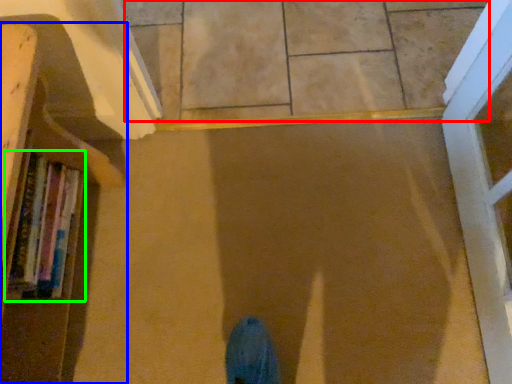
Question: Estimate the real-world distances between objects in this image. Which object is closer to tile (highlighted by a red box), bookcase (highlighted by a blue box) or book (highlighted by a green box)?

Choices:
 (A) bookcase
 (B) book

Answer: (A)